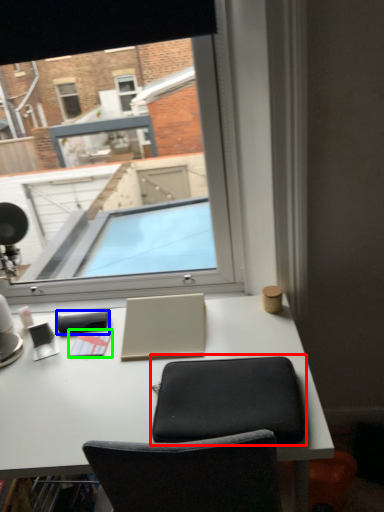
Question: Which object is the closest to the computer chair (highlighted by a red box)? Choose among these: notepad (highlighted by a blue box) or notepad (highlighted by a green box).

Choices:
 (A) notepad
 (B) notepad

Answer: (B)